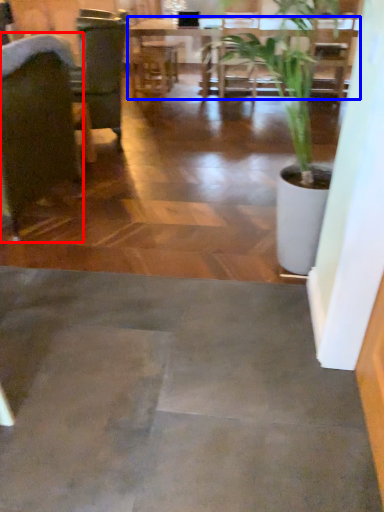
Question: Which object is closer to the camera taking this photo, chair (highlighted by a red box) or table (highlighted by a blue box)?

Choices:
 (A) chair
 (B) table

Answer: (A)